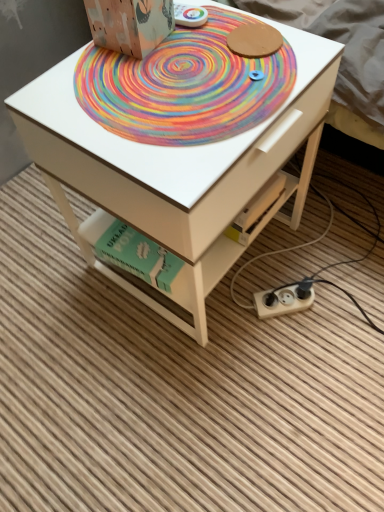
I want to click on free space to the left of white plastic plug at lower right, so click(224, 323).